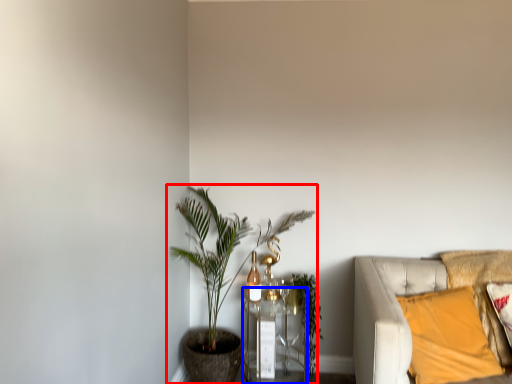
Question: Which object is closer to the camera taking this photo, houseplant (highlighted by a red box) or table (highlighted by a blue box)?

Choices:
 (A) houseplant
 (B) table

Answer: (A)